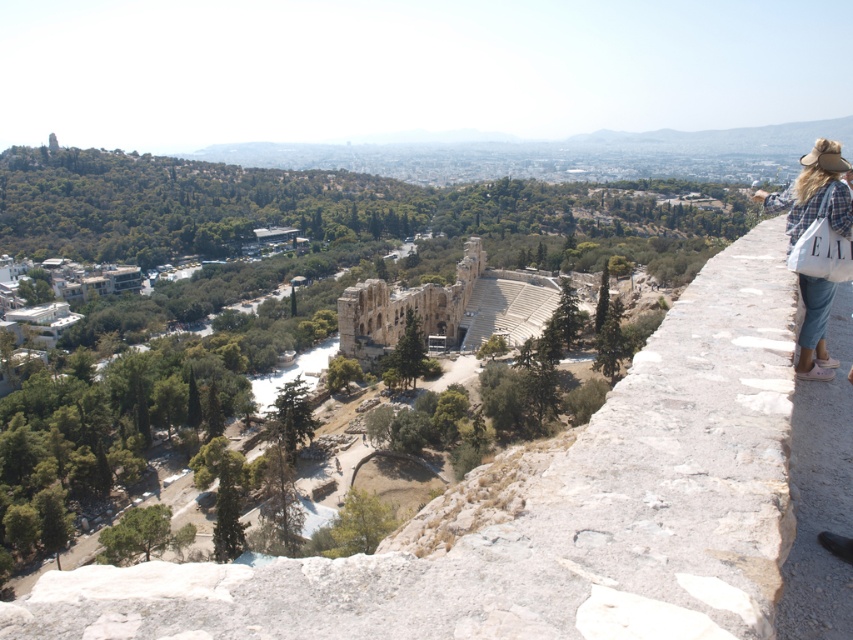
You are standing at the point marked by coordinates (431,308) in the image of the Odeon of Herodes Atticus. Which structure are you closest to?

The beige stone amphitheater at center is represented by point (431,308), so you are closest to the beige stone amphitheater at center.

You are standing at the Odeon of Herodes Atticus in Athens and want to take a photo of the point marked at coordinates (380, 312). Given that the distance between you and this point is 493.62 feet, would you need to use a zoom lens to capture the entire structure in your shot?

The distance between you and the point marked at coordinates (380, 312) is 493.62 feet. To capture the entire structure of the Odeon of Herodes Atticus from that distance, a zoom lens would likely be necessary to ensure the structure isn not too small in the frame.